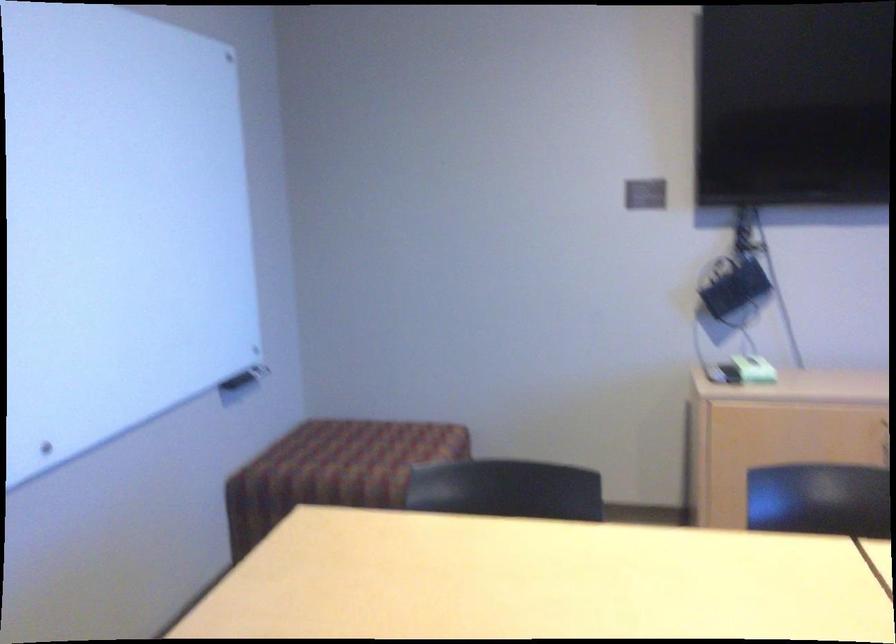
Locate an element on the screen. whiteboard marker tray is located at coordinates coord(246,373).